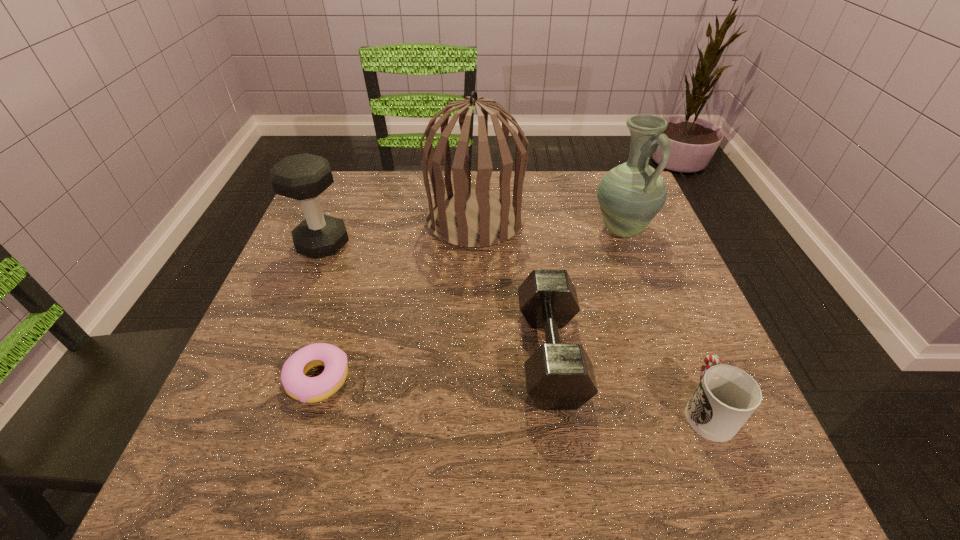
This screenshot has width=960, height=540. Identify the location of doughnut located in the left edge section of the desktop. (306, 389).

Where is `pitcher present at the right edge`? The image size is (960, 540). pitcher present at the right edge is located at coordinates (630, 195).

Locate an element on the screen. Image resolution: width=960 pixels, height=540 pixels. cup that is at the right edge is located at coordinates (726, 397).

You are a GUI agent. You are given a task and a screenshot of the screen. Output one action in this format:
    pyautogui.click(x=<x>, y=<y>)
    Task: Click on the object that is at the far right corner
    The image size is (960, 540).
    Given the screenshot: What is the action you would take?
    pyautogui.click(x=630, y=195)

I want to click on object that is at the near right corner, so 726,397.

Locate an element on the screen. This screenshot has width=960, height=540. vacant region at the far edge of the desktop is located at coordinates (583, 220).

This screenshot has width=960, height=540. What are the coordinates of `vacant area at the near edge` in the screenshot? It's located at (551, 473).

Find the location of a particular element. The image size is (960, 540). vacant space at the left edge of the desktop is located at coordinates (294, 426).

Find the location of `free space at the right edge`. free space at the right edge is located at coordinates (647, 386).

The width and height of the screenshot is (960, 540). I want to click on vacant region between the cup and the doughnut, so click(x=513, y=394).